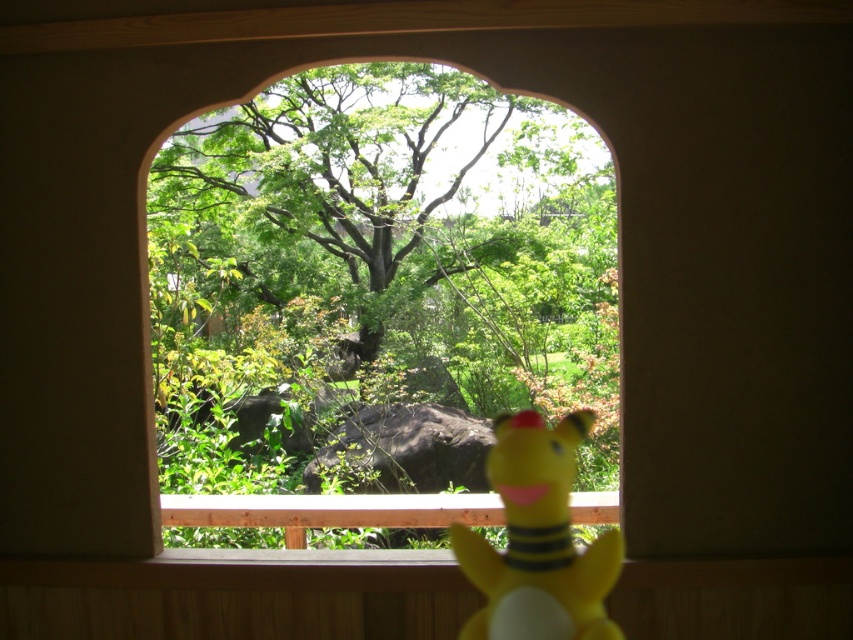
You are an interior designer planning to hang a new painting. You see the green matte window at center and the yellow rubber duck at lower right. Which object is positioned higher in the scene?

The yellow rubber duck at lower right is positioned higher than the green matte window at center because the green matte window at center is located below it.

You are a delivery drone with a wingspan of 2.5 meters. You need to fly through the gap between the green matte window at center and the yellow rubber duck at lower right. Can you fit through the gap?

The distance between the green matte window at center and the yellow rubber duck at lower right is 2.71 meters. Since your wingspan is 2.5 meters, which is less than the gap width, you can safely pass through the gap.